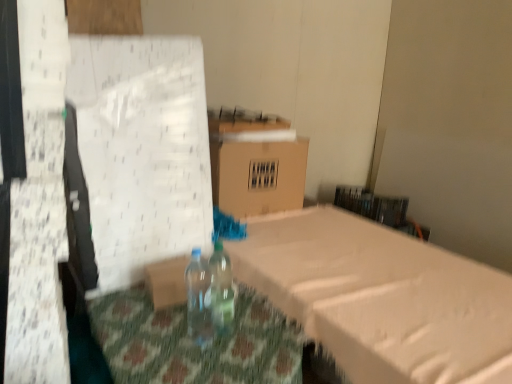
Identify the location of free location to the right of translucent plastic bottle at center, which is the second bottle in right-to-left order. [x=245, y=348].